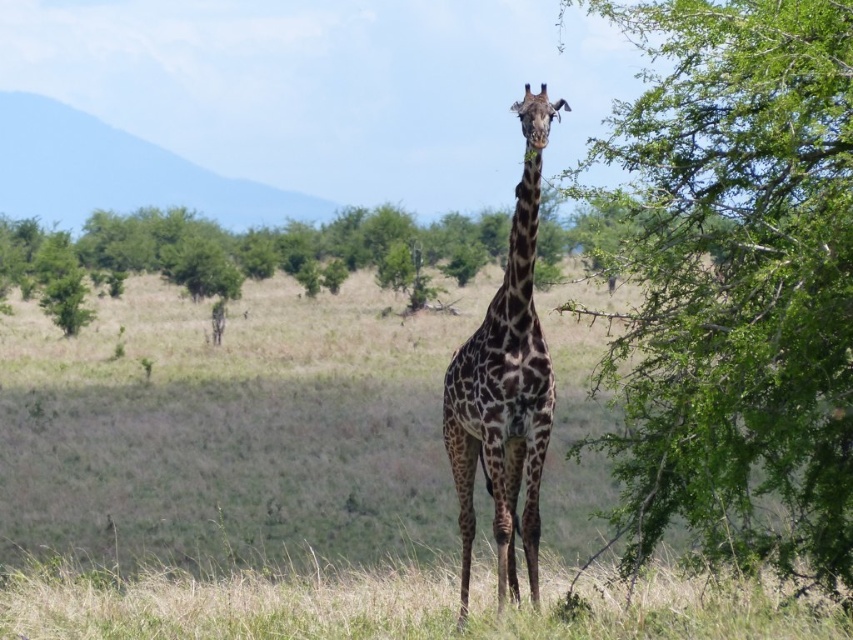
Question: Is green leafy tree at right behind spotted fur giraffe at center?

Choices:
 (A) yes
 (B) no

Answer: (B)

Question: Can you confirm if green leafy tree at right is positioned above spotted fur giraffe at center?

Choices:
 (A) no
 (B) yes

Answer: (B)

Question: Is green leafy tree at right bigger than spotted fur giraffe at center?

Choices:
 (A) yes
 (B) no

Answer: (A)

Question: Which point is closer to the camera?

Choices:
 (A) spotted fur giraffe at center
 (B) green leafy tree at right

Answer: (B)